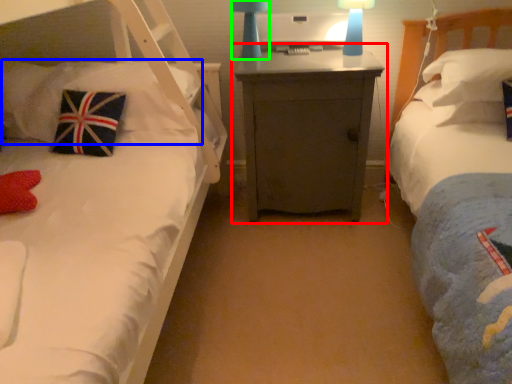
Question: Which object is the farthest from nightstand (highlighted by a red box)? Choose among these: pillow (highlighted by a blue box) or bedside lamp (highlighted by a green box).

Choices:
 (A) pillow
 (B) bedside lamp

Answer: (A)